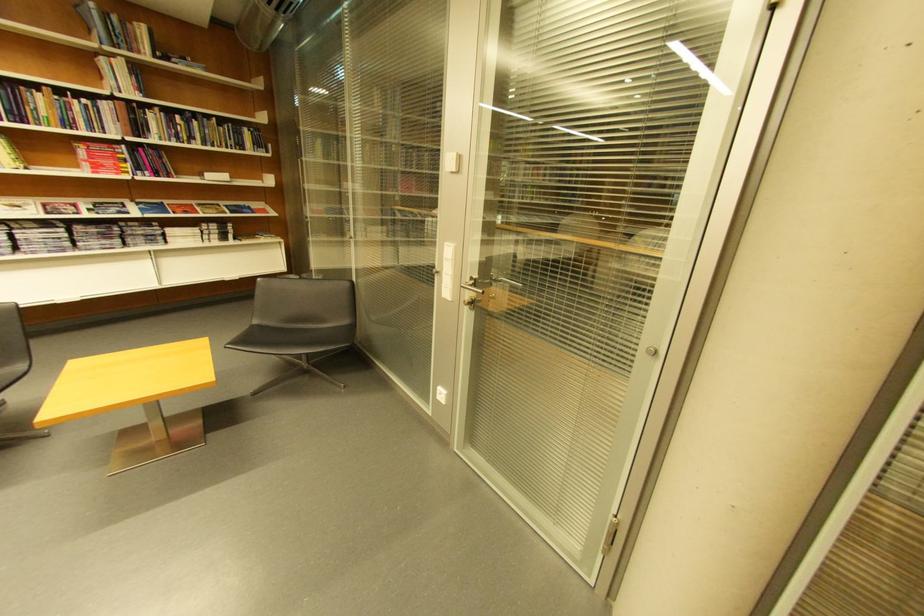
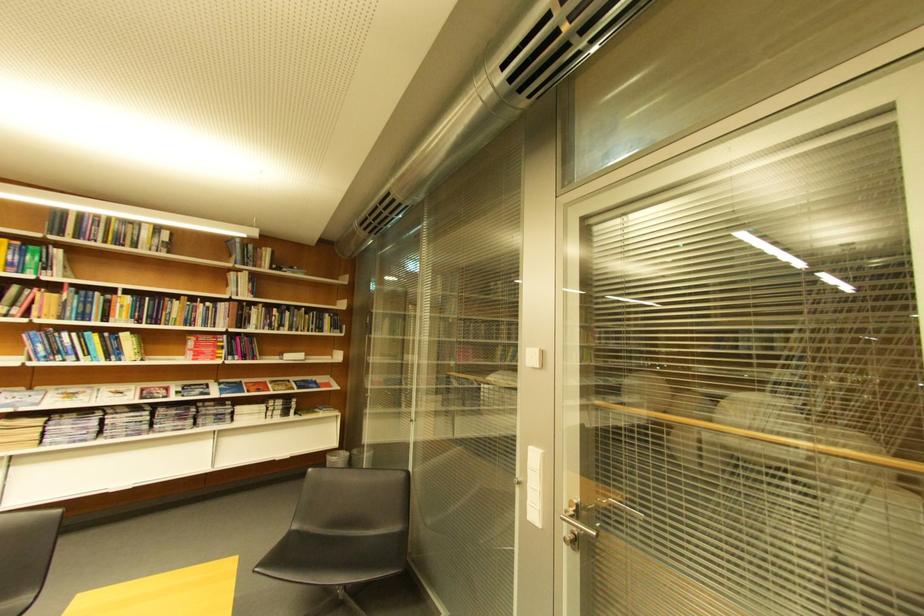
What movement of the cameraman would produce the second image?

The cameraman walked toward left, forward.